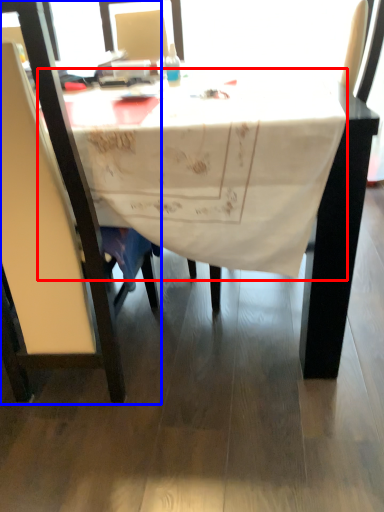
Question: Among these objects, which one is farthest to the camera, tablecloth (highlighted by a red box) or chair (highlighted by a blue box)?

Choices:
 (A) tablecloth
 (B) chair

Answer: (A)